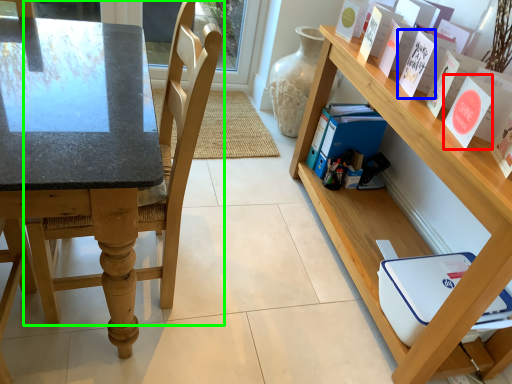
Question: Based on their relative distances, which object is farther from paperback book (highlighted by a red box)? Choose from paperback book (highlighted by a blue box) and chair (highlighted by a green box).

Choices:
 (A) paperback book
 (B) chair

Answer: (B)